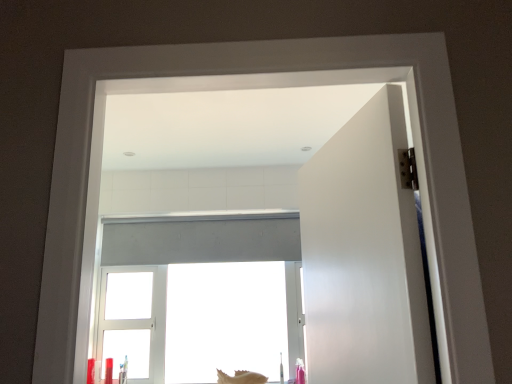
Question: Is smooth beige seashell at lower center next to white matte door at right?

Choices:
 (A) yes
 (B) no

Answer: (B)

Question: Is smooth beige seashell at lower center located outside white matte door at right?

Choices:
 (A) yes
 (B) no

Answer: (A)

Question: Is smooth beige seashell at lower center surrounding white matte door at right?

Choices:
 (A) no
 (B) yes

Answer: (A)

Question: From the image's perspective, is smooth beige seashell at lower center located beneath white matte door at right?

Choices:
 (A) yes
 (B) no

Answer: (A)

Question: Is smooth beige seashell at lower center oriented towards white matte door at right?

Choices:
 (A) no
 (B) yes

Answer: (A)

Question: Can you confirm if smooth beige seashell at lower center is shorter than white matte door at right?

Choices:
 (A) no
 (B) yes

Answer: (B)

Question: Does white matte window at center appear on the left side of smooth beige seashell at lower center?

Choices:
 (A) no
 (B) yes

Answer: (B)

Question: From the image's perspective, is white matte window at center below smooth beige seashell at lower center?

Choices:
 (A) yes
 (B) no

Answer: (B)

Question: Is white matte window at center located outside smooth beige seashell at lower center?

Choices:
 (A) no
 (B) yes

Answer: (B)

Question: Does white matte window at center have a smaller size compared to smooth beige seashell at lower center?

Choices:
 (A) no
 (B) yes

Answer: (A)

Question: Is white matte window at center further to camera compared to smooth beige seashell at lower center?

Choices:
 (A) no
 (B) yes

Answer: (B)

Question: Considering the relative sizes of white matte window at center and smooth beige seashell at lower center in the image provided, is white matte window at center shorter than smooth beige seashell at lower center?

Choices:
 (A) no
 (B) yes

Answer: (A)

Question: Is the position of white matte door at right less distant than that of white matte window at center?

Choices:
 (A) no
 (B) yes

Answer: (B)